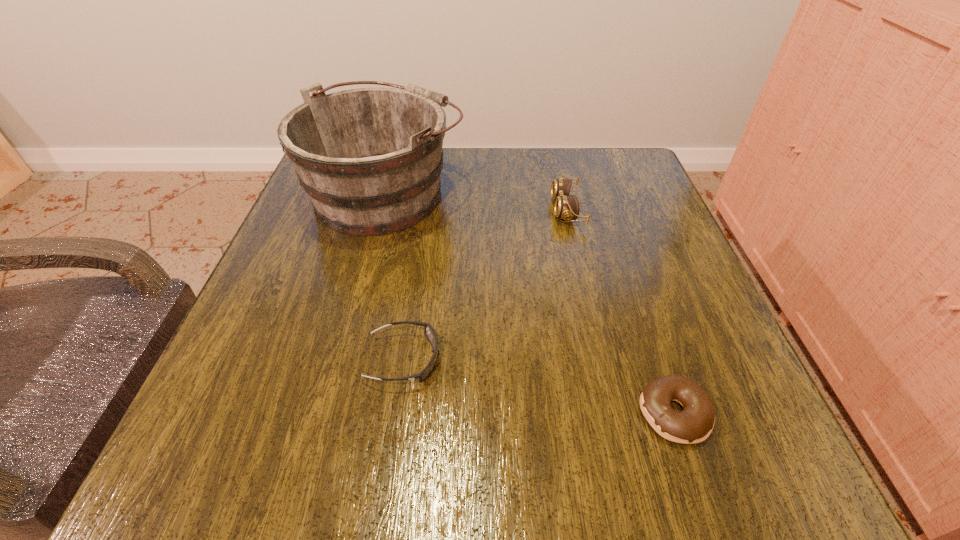
Where is `free region located on the lenses of the left goggles`? free region located on the lenses of the left goggles is located at coordinates (564, 359).

Where is `vacant space located on the back of the doughnut`? vacant space located on the back of the doughnut is located at coordinates (622, 259).

Locate an element on the screen. The height and width of the screenshot is (540, 960). wine bucket that is at the far edge is located at coordinates (370, 159).

Locate an element on the screen. goggles situated at the far edge is located at coordinates (566, 207).

The height and width of the screenshot is (540, 960). I want to click on object at the near edge, so click(694, 424).

Find the location of a particular element. object positioned at the left edge is located at coordinates (370, 159).

You are a GUI agent. You are given a task and a screenshot of the screen. Output one action in this format:
    pyautogui.click(x=<x>, y=<y>)
    Task: Click on the object situated at the right edge
    
    Given the screenshot: What is the action you would take?
    pyautogui.click(x=694, y=424)

Where is `object positioned at the far left corner`? The width and height of the screenshot is (960, 540). object positioned at the far left corner is located at coordinates [x=370, y=159].

You are a GUI agent. You are given a task and a screenshot of the screen. Output one action in this format:
    pyautogui.click(x=<x>, y=<y>)
    Task: Click on the object present at the near right corner
    
    Given the screenshot: What is the action you would take?
    pyautogui.click(x=694, y=424)

What are the coordinates of `vacant area at the far edge of the desktop` in the screenshot? It's located at (526, 152).